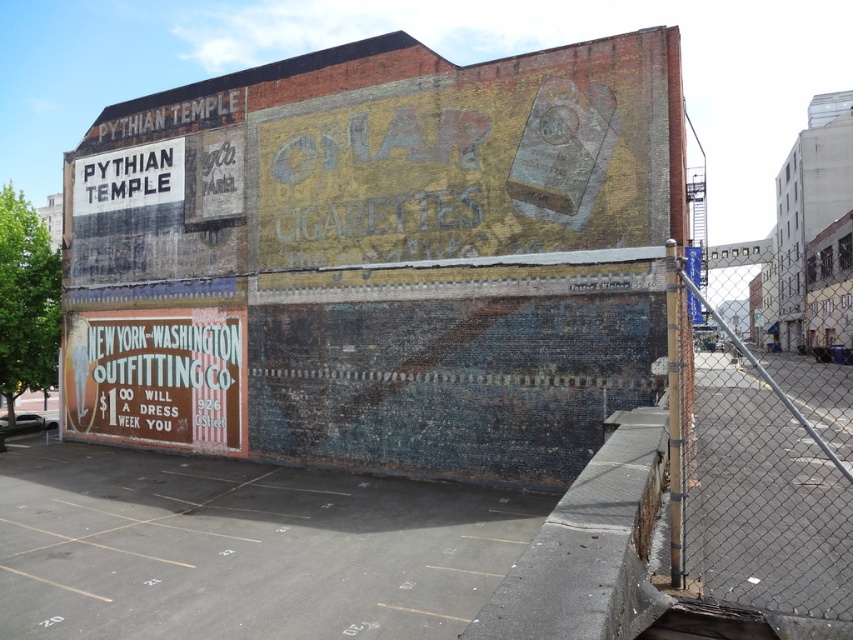
Question: Which point is closer to the camera?

Choices:
 (A) rusty chain-link fence at right
 (B) weathered brick wall at center

Answer: (A)

Question: Is weathered brick wall at center to the left of rusty chain-link fence at right from the viewer's perspective?

Choices:
 (A) yes
 (B) no

Answer: (A)

Question: Can you confirm if weathered brick wall at center is positioned to the right of rusty chain-link fence at right?

Choices:
 (A) yes
 (B) no

Answer: (B)

Question: Does weathered brick wall at center have a smaller size compared to rusty chain-link fence at right?

Choices:
 (A) no
 (B) yes

Answer: (B)

Question: Which point is farther to the camera?

Choices:
 (A) weathered brick wall at center
 (B) rusty chain-link fence at right

Answer: (A)